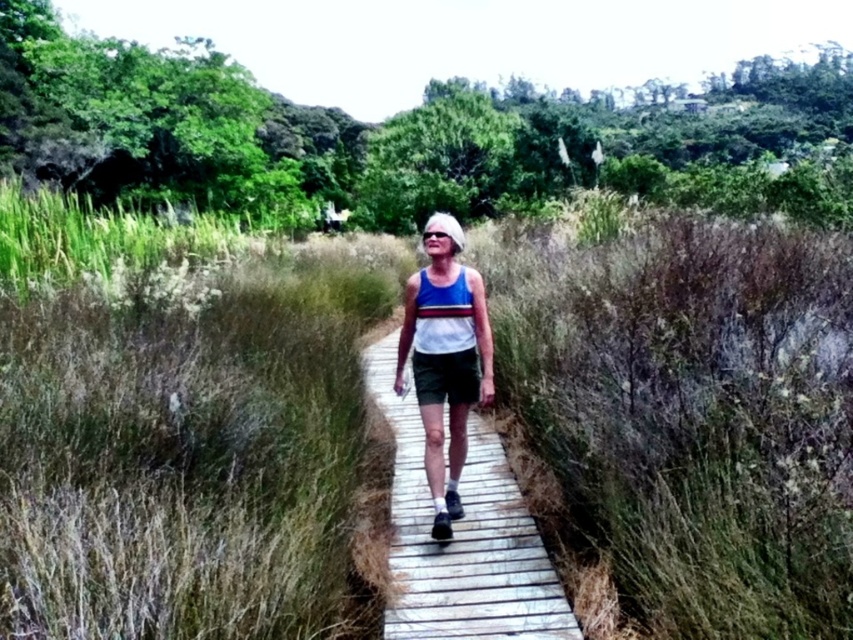
Consider the image. Is green grass at center thinner than white fabric tank top at center?

No.

Is green grass at center smaller than white fabric tank top at center?

Yes.

Find the location of a particular element. The image size is (853, 640). green grass at center is located at coordinates (178, 424).

Does wooden boardwalk at center have a lesser width compared to white fabric tank top at center?

Incorrect, wooden boardwalk at center's width is not less than white fabric tank top at center's.

What do you see at coordinates (462, 538) in the screenshot? The image size is (853, 640). I see `wooden boardwalk at center` at bounding box center [462, 538].

What are the coordinates of `wooden boardwalk at center` in the screenshot? It's located at (462, 538).

Does green grass at center appear on the left side of green grass at upper left?

Incorrect, green grass at center is not on the left side of green grass at upper left.

The image size is (853, 640). Describe the element at coordinates (178, 424) in the screenshot. I see `green grass at center` at that location.

Does point (35, 269) lie behind point (32, 216)?

No, (35, 269) is in front of (32, 216).

This screenshot has width=853, height=640. I want to click on green grass at center, so click(x=178, y=424).